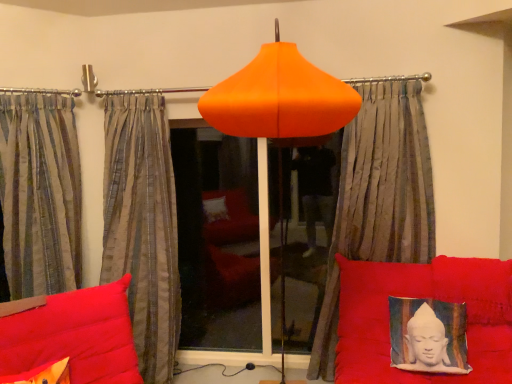
Locate an element on the screen. striped fabric curtain at left, marked as the 2th curtain in a left-to-right arrangement is located at coordinates (142, 224).

What do you see at coordinates (217, 241) in the screenshot?
I see `transparent glass window at center` at bounding box center [217, 241].

I want to click on silky gray curtain at center, acting as the first curtain starting from the right, so 378,195.

Where is `striped fabric curtain at left, which appears as the first curtain when viewed from the left`? The image size is (512, 384). striped fabric curtain at left, which appears as the first curtain when viewed from the left is located at coordinates (40, 192).

Does striped fabric curtain at left, marked as the 2th curtain in a left-to-right arrangement, have a greater width compared to transparent glass window at center?

Correct, the width of striped fabric curtain at left, marked as the 2th curtain in a left-to-right arrangement, exceeds that of transparent glass window at center.

Considering the relative sizes of striped fabric curtain at left, marked as the 2th curtain in a left-to-right arrangement, and transparent glass window at center in the image provided, is striped fabric curtain at left, marked as the 2th curtain in a left-to-right arrangement, smaller than transparent glass window at center?

No, striped fabric curtain at left, marked as the 2th curtain in a left-to-right arrangement, is not smaller than transparent glass window at center.

From the image's perspective, is striped fabric curtain at left, marked as the 2th curtain in a left-to-right arrangement, over transparent glass window at center?

Yes, from the image's perspective, striped fabric curtain at left, marked as the 2th curtain in a left-to-right arrangement, is over transparent glass window at center.

At what (x,y) coordinates should I click in order to perform the action: click on curtain that is the 1st object to the left of the transparent glass window at center, starting at the anchor. Please return your answer as a coordinate pair (x, y). The image size is (512, 384). Looking at the image, I should click on (142, 224).

Is striped fabric curtain at left, marked as the 2th curtain in a left-to-right arrangement, closer to camera compared to striped fabric curtain at left, which appears as the first curtain when viewed from the left?

No, striped fabric curtain at left, marked as the 2th curtain in a left-to-right arrangement, is behind striped fabric curtain at left, which appears as the first curtain when viewed from the left.

Is striped fabric curtain at left, the second curtain viewed from the right, positioned far away from striped fabric curtain at left, which appears as the 3th curtain when viewed from the right?

That's not correct — striped fabric curtain at left, the second curtain viewed from the right, is a little close to striped fabric curtain at left, which appears as the 3th curtain when viewed from the right.

From the image's perspective, would you say striped fabric curtain at left, the second curtain viewed from the right, is positioned over striped fabric curtain at left, which appears as the 3th curtain when viewed from the right?

No, from the image's perspective, striped fabric curtain at left, the second curtain viewed from the right, is not over striped fabric curtain at left, which appears as the 3th curtain when viewed from the right.

Looking at their sizes, would you say silky gray curtain at center, marked as the third curtain in a left-to-right arrangement, is wider or thinner than textured fabric cushion with buddha print at lower right?

Clearly, silky gray curtain at center, marked as the third curtain in a left-to-right arrangement, has more width compared to textured fabric cushion with buddha print at lower right.

Which is behind, point (401, 250) or point (411, 341)?

The point (401, 250) is farther from the camera.

From a real-world perspective, is silky gray curtain at center, acting as the first curtain starting from the right, physically below textured fabric cushion with buddha print at lower right?

Incorrect, from a real-world perspective, silky gray curtain at center, acting as the first curtain starting from the right, is higher than textured fabric cushion with buddha print at lower right.

I want to click on curtain that is the 1st object to the left of the textured fabric cushion with buddha print at lower right, starting at the anchor, so click(378, 195).

Which object is wider, transparent glass window at center or matte orange pillow at lower left?

Wider between the two is matte orange pillow at lower left.

Looking at this image, is the surface of transparent glass window at center in direct contact with matte orange pillow at lower left?

They are not placed beside each other.

How many degrees apart are the facing directions of transparent glass window at center and matte orange pillow at lower left?

They differ by 45.7 degrees in their facing directions.

How different are the orientations of matte orange pillow at lower left and striped fabric curtain at left, the second curtain viewed from the right, in degrees?

There is a 41.6-degree angle between the facing directions of matte orange pillow at lower left and striped fabric curtain at left, the second curtain viewed from the right.

Does point (4, 379) come farther from viewer compared to point (134, 240)?

No, it is in front of (134, 240).

Considering the sizes of matte orange pillow at lower left and striped fabric curtain at left, marked as the 2th curtain in a left-to-right arrangement, in the image, is matte orange pillow at lower left bigger or smaller than striped fabric curtain at left, marked as the 2th curtain in a left-to-right arrangement,?

Considering their sizes, matte orange pillow at lower left takes up less space than striped fabric curtain at left, marked as the 2th curtain in a left-to-right arrangement.

From the image's perspective, between textured fabric cushion with buddha print at lower right and matte orange pillow at lower left, who is located below?

From the image's view, matte orange pillow at lower left is below.

In the scene shown: Between textured fabric cushion with buddha print at lower right and matte orange pillow at lower left, which one has less height?

matte orange pillow at lower left is shorter.

Which object is positioned more to the right, textured fabric cushion with buddha print at lower right or matte orange pillow at lower left?

textured fabric cushion with buddha print at lower right.

Are textured fabric cushion with buddha print at lower right and matte orange pillow at lower left making contact?

No, textured fabric cushion with buddha print at lower right is not beside matte orange pillow at lower left.

Is matte orange pillow at lower left taller or shorter than striped fabric curtain at left, which appears as the first curtain when viewed from the left?

matte orange pillow at lower left is shorter than striped fabric curtain at left, which appears as the first curtain when viewed from the left.

Is matte orange pillow at lower left located outside striped fabric curtain at left, which appears as the first curtain when viewed from the left?

Yes, matte orange pillow at lower left is outside of striped fabric curtain at left, which appears as the first curtain when viewed from the left.

Is matte orange pillow at lower left next to striped fabric curtain at left, which appears as the 3th curtain when viewed from the right?

There is a gap between matte orange pillow at lower left and striped fabric curtain at left, which appears as the 3th curtain when viewed from the right.

Is matte orange pillow at lower left turned away from striped fabric curtain at left, which appears as the 3th curtain when viewed from the right?

matte orange pillow at lower left is not turned away from striped fabric curtain at left, which appears as the 3th curtain when viewed from the right.

The width and height of the screenshot is (512, 384). What are the coordinates of `window screen below the striped fabric curtain at left, the second curtain viewed from the right (from the image's perspective)` in the screenshot? It's located at (217, 241).

The height and width of the screenshot is (384, 512). I want to click on curtain positioned vertically above the striped fabric curtain at left, marked as the 2th curtain in a left-to-right arrangement (from a real-world perspective), so click(40, 192).

Looking at the image, which one is located further to textured fabric cushion with buddha print at lower right, orange matte lampshade at center or silky gray curtain at center, acting as the first curtain starting from the right?

Based on the image, orange matte lampshade at center appears to be further to textured fabric cushion with buddha print at lower right.

When comparing their distances from striped fabric curtain at left, which appears as the first curtain when viewed from the left, does orange matte lampshade at center or textured fabric cushion with buddha print at lower right seem closer?

The object closer to striped fabric curtain at left, which appears as the first curtain when viewed from the left, is orange matte lampshade at center.

Which object lies nearer to the anchor point striped fabric curtain at left, the second curtain viewed from the right, matte orange pillow at lower left or velvet cushion with buddha print at lower right?

matte orange pillow at lower left is positioned closer to the anchor striped fabric curtain at left, the second curtain viewed from the right.

Estimate the real-world distances between objects in this image. Which object is closer to transparent glass window at center, matte orange pillow at lower left or velvet cushion with buddha print at lower right?

velvet cushion with buddha print at lower right lies closer to transparent glass window at center than the other object.

When comparing their distances from orange matte lampshade at center, does textured fabric cushion with buddha print at lower right or matte orange pillow at lower left seem closer?

textured fabric cushion with buddha print at lower right is positioned closer to the anchor orange matte lampshade at center.

From the image, which object appears to be nearer to striped fabric curtain at left, the second curtain viewed from the right, transparent glass window at center or orange matte lampshade at center?

transparent glass window at center is closer to striped fabric curtain at left, the second curtain viewed from the right.

Looking at the image, which one is located closer to silky gray curtain at center, marked as the third curtain in a left-to-right arrangement, orange matte lampshade at center or striped fabric curtain at left, the second curtain viewed from the right?

Among the two, orange matte lampshade at center is located nearer to silky gray curtain at center, marked as the third curtain in a left-to-right arrangement.

Consider the image. Which object lies further to the anchor point striped fabric curtain at left, which appears as the first curtain when viewed from the left, transparent glass window at center or textured fabric cushion with buddha print at lower right?

textured fabric cushion with buddha print at lower right is positioned further to the anchor striped fabric curtain at left, which appears as the first curtain when viewed from the left.

At what (x,y) coordinates should I click in order to perform the action: click on window screen located between matte orange pillow at lower left and textured fabric cushion with buddha print at lower right in the left-right direction. Please return your answer as a coordinate pair (x, y). The image size is (512, 384). Looking at the image, I should click on (217, 241).

At what (x,y) coordinates should I click in order to perform the action: click on lamp between matte orange pillow at lower left and velvet cushion with buddha print at lower right from left to right. Please return your answer as a coordinate pair (x, y). Looking at the image, I should click on (278, 113).

Locate an element on the screen. furniture between striped fabric curtain at left, which appears as the 3th curtain when viewed from the right, and textured fabric cushion with buddha print at lower right is located at coordinates pyautogui.click(x=423, y=297).

You are a GUI agent. You are given a task and a screenshot of the screen. Output one action in this format:
    pyautogui.click(x=<x>, y=<y>)
    Task: Click on the furniture situated between striped fabric curtain at left, marked as the 2th curtain in a left-to-right arrangement, and textured fabric cushion with buddha print at lower right from left to right
    The image size is (512, 384).
    Given the screenshot: What is the action you would take?
    pyautogui.click(x=423, y=297)